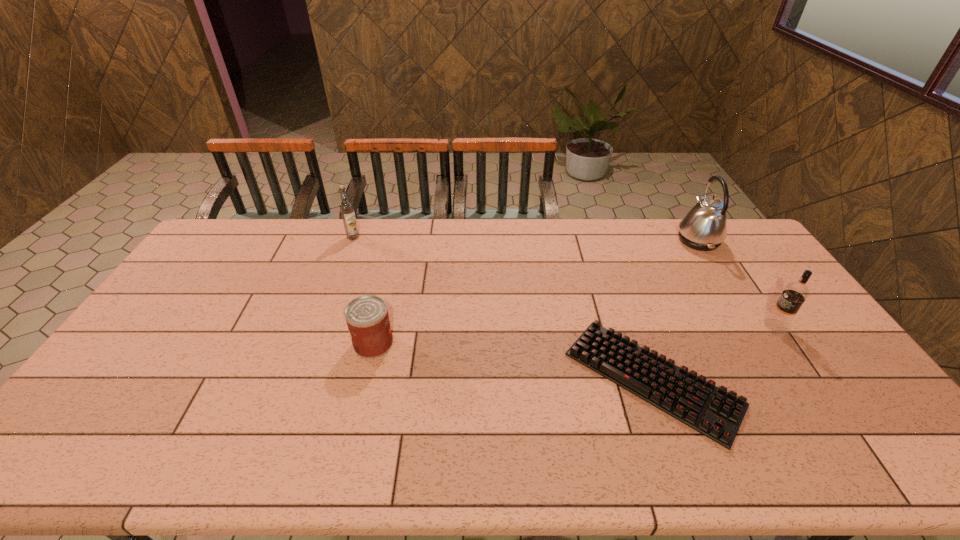
Identify the location of free region located 0.360m from the spout of the tallest object. (580, 240).

At what (x,y) coordinates should I click in order to perform the action: click on vacant space situated 0.290m on the label of the leftmost object. Please return your answer as a coordinate pair (x, y). This screenshot has height=540, width=960. Looking at the image, I should click on (332, 294).

You are a GUI agent. You are given a task and a screenshot of the screen. Output one action in this format:
    pyautogui.click(x=<x>, y=<y>)
    Task: Click on the free location located 0.330m on the label of the nearer vodka
    The image size is (960, 540).
    Given the screenshot: What is the action you would take?
    pyautogui.click(x=655, y=326)

At what (x,y) coordinates should I click in order to perform the action: click on free location located on the label of the nearer vodka. Please return your answer as a coordinate pair (x, y). The image size is (960, 540). Looking at the image, I should click on (741, 326).

At what (x,y) coordinates should I click in order to perform the action: click on vacant space positioned 0.390m on the label of the nearer vodka. Please return your answer as a coordinate pair (x, y). Looking at the image, I should click on (635, 326).

Identify the location of vacant space located on the back of the can. (392, 267).

You are a GUI agent. You are given a task and a screenshot of the screen. Output one action in this format:
    pyautogui.click(x=<x>, y=<y>)
    Task: Click on the vacant space located 0.120m on the right of the computer keyboard
    This screenshot has height=540, width=960.
    Given the screenshot: What is the action you would take?
    pyautogui.click(x=780, y=379)

Where is `kettle situated at the far edge`? This screenshot has height=540, width=960. kettle situated at the far edge is located at coordinates (704, 228).

Image resolution: width=960 pixels, height=540 pixels. I want to click on vodka located in the far edge section of the desktop, so click(x=346, y=207).

At what (x,y) coordinates should I click in order to perform the action: click on object that is at the near edge. Please return your answer as a coordinate pair (x, y). Looking at the image, I should click on (712, 411).